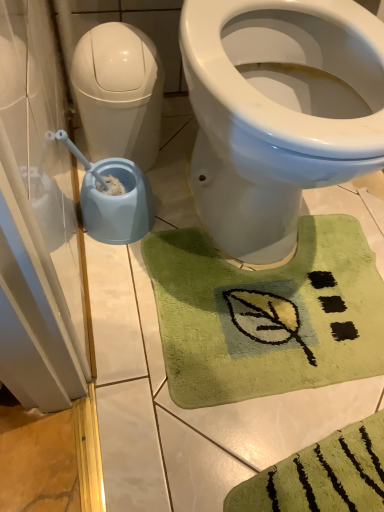
This screenshot has height=512, width=384. What do you see at coordinates (278, 112) in the screenshot?
I see `blue plastic bidet at left` at bounding box center [278, 112].

What are the coordinates of `transparent plastic screen door at left` in the screenshot? It's located at (43, 242).

Find the location of a particular element. The height and width of the screenshot is (512, 384). blue plastic bidet at left is located at coordinates (278, 112).

In the scene shown: Between white glossy water tank at left and green plush bath mat at lower center, which one has larger width?

With larger width is green plush bath mat at lower center.

Does white glossy water tank at left come in front of green plush bath mat at lower center?

No, white glossy water tank at left is behind green plush bath mat at lower center.

Considering the relative positions of white glossy water tank at left and green plush bath mat at lower center in the image provided, is white glossy water tank at left to the left of green plush bath mat at lower center from the viewer's perspective?

Yes, white glossy water tank at left is to the left of green plush bath mat at lower center.

Based on their sizes in the image, would you say white glossy water tank at left is bigger or smaller than green plush bath mat at lower center?

Clearly, white glossy water tank at left is larger in size than green plush bath mat at lower center.

How many degrees apart are the facing directions of white glossy water tank at left and transparent plastic screen door at left?

The angular difference between white glossy water tank at left and transparent plastic screen door at left is 88.7 degrees.

Which is farther, (117, 58) or (76, 356)?

The point (117, 58) is more distant.

Is white glossy water tank at left taller or shorter than transparent plastic screen door at left?

Considering their sizes, white glossy water tank at left has more height than transparent plastic screen door at left.

Visually, is white glossy water tank at left positioned to the left or to the right of transparent plastic screen door at left?

white glossy water tank at left is to the right of transparent plastic screen door at left.

Does transparent plastic screen door at left touch blue plastic bidet at left?

There is a gap between transparent plastic screen door at left and blue plastic bidet at left.

Is transparent plastic screen door at left oriented away from blue plastic bidet at left?

No.

You are a GUI agent. You are given a task and a screenshot of the screen. Output one action in this format:
    pyautogui.click(x=<x>, y=<y>)
    Task: Click on the bidet on the right of transparent plastic screen door at left
    This screenshot has width=384, height=512.
    Given the screenshot: What is the action you would take?
    pyautogui.click(x=278, y=112)

Based on their positions, is transparent plastic screen door at left located to the left or right of blue plastic bidet at left?

transparent plastic screen door at left is positioned on blue plastic bidet at left's left side.

Based on their positions, is blue plastic bidet at left located to the left or right of white glossy water tank at left?

Based on their positions, blue plastic bidet at left is located to the right of white glossy water tank at left.

Is blue plastic bidet at left turned away from white glossy water tank at left?

No, blue plastic bidet at left is not facing the opposite direction of white glossy water tank at left.

Which is behind, point (256, 2) or point (117, 108)?

Positioned behind is point (117, 108).

Between blue plastic bidet at left and white glossy water tank at left, which one has smaller width?

white glossy water tank at left.

Is green plush bath mat at lower center shorter than white glossy water tank at left?

Yes.

Can you tell me how much green plush bath mat at lower center and white glossy water tank at left differ in facing direction?

The angle between the facing direction of green plush bath mat at lower center and the facing direction of white glossy water tank at left is 2.76 degrees.

Considering the positions of points (289, 279) and (127, 47), is point (289, 279) farther from camera compared to point (127, 47)?

Yes.

Considering their positions, is transparent plastic screen door at left located in front of or behind green plush bath mat at lower center?

transparent plastic screen door at left is positioned closer to the viewer than green plush bath mat at lower center.

Is transparent plastic screen door at left oriented away from green plush bath mat at lower center?

No, transparent plastic screen door at left is not facing away from green plush bath mat at lower center.

Choose the correct answer: Is transparent plastic screen door at left inside green plush bath mat at lower center or outside it?

transparent plastic screen door at left is outside green plush bath mat at lower center.

How different are the orientations of transparent plastic screen door at left and green plush bath mat at lower center in degrees?

transparent plastic screen door at left and green plush bath mat at lower center are facing 91.4 degrees away from each other.

Which object is positioned more to the right, blue plastic bidet at left or green plush bath mat at lower center?

From the viewer's perspective, green plush bath mat at lower center appears more on the right side.

Considering the sizes of objects blue plastic bidet at left and green plush bath mat at lower center in the image provided, who is taller, blue plastic bidet at left or green plush bath mat at lower center?

blue plastic bidet at left.

Can you confirm if blue plastic bidet at left is thinner than green plush bath mat at lower center?

No.

From the picture: Could green plush bath mat at lower center be considered to be inside blue plastic bidet at left?

Yes, blue plastic bidet at left contains green plush bath mat at lower center.

Identify the location of water tank behind the green plush bath mat at lower center. (119, 92).

This screenshot has height=512, width=384. In order to click on water tank located above the transparent plastic screen door at left (from a real-world perspective) in this screenshot , I will do 119,92.

Looking at the image, which one is located further to white glossy water tank at left, transparent plastic screen door at left or blue plastic bidet at left?

blue plastic bidet at left is positioned further to the anchor white glossy water tank at left.

Based on their spatial positions, is blue plastic bidet at left or white glossy water tank at left closer to green plush bath mat at lower center?

blue plastic bidet at left lies closer to green plush bath mat at lower center than the other object.

Considering their positions, is transparent plastic screen door at left positioned further to green plush bath mat at lower center than blue plastic bidet at left?

transparent plastic screen door at left is positioned further to the anchor green plush bath mat at lower center.

Considering their positions, is white glossy water tank at left positioned further to green plush bath mat at lower center than transparent plastic screen door at left?

Among the two, white glossy water tank at left is located further to green plush bath mat at lower center.

In the scene shown: Looking at the image, which one is located further to white glossy water tank at left, transparent plastic screen door at left or green plush bath mat at lower center?

green plush bath mat at lower center lies further to white glossy water tank at left than the other object.

Considering their positions, is blue plastic bidet at left positioned further to transparent plastic screen door at left than white glossy water tank at left?

The object further to transparent plastic screen door at left is blue plastic bidet at left.

Which object lies nearer to the anchor point white glossy water tank at left, green plush bath mat at lower center or blue plastic bidet at left?

Among the two, blue plastic bidet at left is located nearer to white glossy water tank at left.

From the image, which object appears to be nearer to blue plastic bidet at left, white glossy water tank at left or green plush bath mat at lower center?

Among the two, green plush bath mat at lower center is located nearer to blue plastic bidet at left.

Locate an element on the screen. The image size is (384, 512). water tank between transparent plastic screen door at left and blue plastic bidet at left from left to right is located at coordinates (119, 92).

Identify the location of bidet located between transparent plastic screen door at left and green plush bath mat at lower center in the left-right direction. (278, 112).

Where is `water tank located between transparent plastic screen door at left and green plush bath mat at lower center in the left-right direction`? water tank located between transparent plastic screen door at left and green plush bath mat at lower center in the left-right direction is located at coordinates (119, 92).

Image resolution: width=384 pixels, height=512 pixels. I want to click on water tank between blue plastic bidet at left and green plush bath mat at lower center vertically, so click(119, 92).